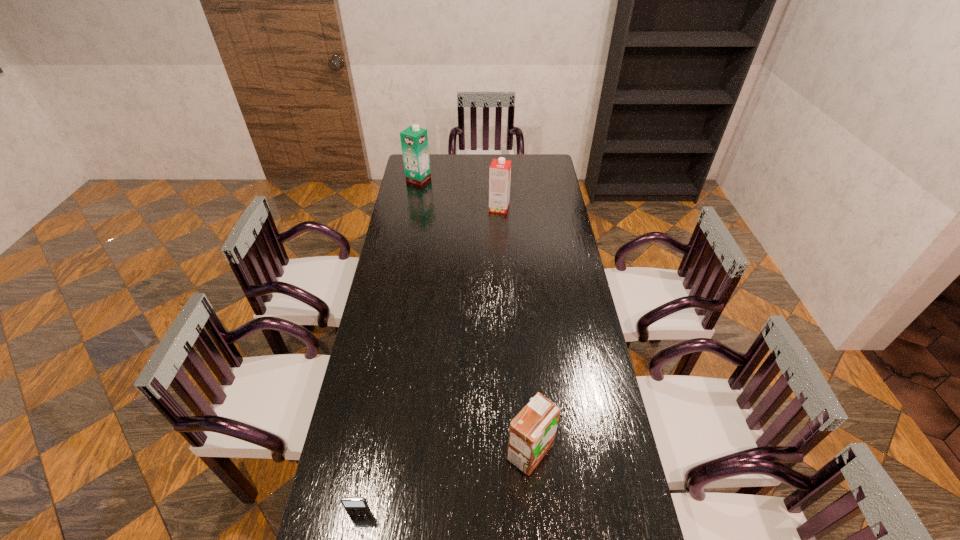
Locate an element on the screen. The image size is (960, 540). empty space between the farthest carton and the third tallest object is located at coordinates (474, 315).

Locate an element on the screen. Image resolution: width=960 pixels, height=540 pixels. vacant area that lies between the nearest carton and the farthest carton is located at coordinates (474, 315).

Identify the location of vacant region between the shortest object and the second farthest carton. This screenshot has height=540, width=960. (429, 361).

You are a GUI agent. You are given a task and a screenshot of the screen. Output one action in this format:
    pyautogui.click(x=<x>, y=<y>)
    Task: Click on the vacant area that lies between the third nearest object and the second nearest object
    
    Given the screenshot: What is the action you would take?
    pyautogui.click(x=515, y=330)

Locate an element on the screen. The image size is (960, 540). vacant space that's between the third nearest object and the iPod is located at coordinates (429, 361).

At what (x,y) coordinates should I click in order to perform the action: click on vacant space that's between the second farthest object and the shortest object. Please return your answer as a coordinate pair (x, y). The image size is (960, 540). Looking at the image, I should click on (429, 361).

I want to click on vacant area that lies between the shortest object and the farthest object, so click(x=389, y=347).

Find the location of `vacant area that lies between the third tallest object and the second farthest carton`. vacant area that lies between the third tallest object and the second farthest carton is located at coordinates (515, 330).

In order to click on vacant region between the nearest carton and the second farthest carton in this screenshot , I will do `click(515, 330)`.

Locate an element on the screen. The height and width of the screenshot is (540, 960). vacant space that's between the iPod and the farthest carton is located at coordinates (389, 347).